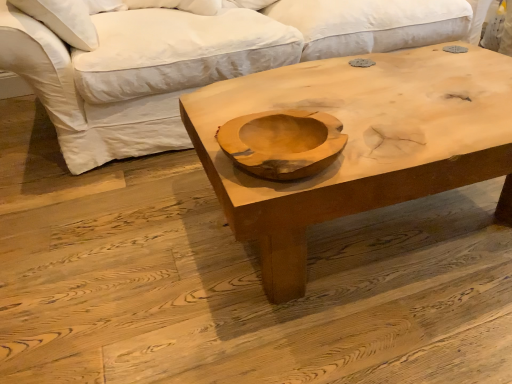
This screenshot has width=512, height=384. What are the coordinates of `white cotton studio couch at upper center` in the screenshot? It's located at (194, 61).

What do you see at coordinates (194, 61) in the screenshot?
I see `white cotton studio couch at upper center` at bounding box center [194, 61].

What is the approximate height of natural wood coffee table at center?

natural wood coffee table at center is 17.01 inches in height.

You are a GUI agent. You are given a task and a screenshot of the screen. Output one action in this format:
    pyautogui.click(x=<x>, y=<y>)
    Task: Click on the natural wood coffee table at center
    Image resolution: width=512 pixels, height=384 pixels.
    Given the screenshot: What is the action you would take?
    pyautogui.click(x=360, y=143)

Image resolution: width=512 pixels, height=384 pixels. Describe the element at coordinates (360, 143) in the screenshot. I see `natural wood coffee table at center` at that location.

Where is `white cotton studio couch at upper center`? white cotton studio couch at upper center is located at coordinates (194, 61).

Does natural wood coffee table at center appear on the right side of white cotton studio couch at upper center?

Correct, you'll find natural wood coffee table at center to the right of white cotton studio couch at upper center.

Which is in front, natural wood coffee table at center or white cotton studio couch at upper center?

natural wood coffee table at center.

Which is closer to the camera, (399,152) or (441,12)?

Point (399,152).

From the image's perspective, is natural wood coffee table at center over white cotton studio couch at upper center?

Incorrect, from the image's perspective, natural wood coffee table at center is lower than white cotton studio couch at upper center.

From a real-world perspective, is natural wood coffee table at center below white cotton studio couch at upper center?

Yes, from a real-world perspective, natural wood coffee table at center is below white cotton studio couch at upper center.

Considering the sizes of objects natural wood coffee table at center and white cotton studio couch at upper center in the image provided, who is wider, natural wood coffee table at center or white cotton studio couch at upper center?

white cotton studio couch at upper center is wider.

Considering the sizes of objects natural wood coffee table at center and white cotton studio couch at upper center in the image provided, who is taller, natural wood coffee table at center or white cotton studio couch at upper center?

white cotton studio couch at upper center is taller.

From the picture: Considering the relative sizes of natural wood coffee table at center and white cotton studio couch at upper center in the image provided, is natural wood coffee table at center smaller than white cotton studio couch at upper center?

Correct, natural wood coffee table at center occupies less space than white cotton studio couch at upper center.

Is natural wood coffee table at center positioned beyond the bounds of white cotton studio couch at upper center?

Yes, natural wood coffee table at center is outside of white cotton studio couch at upper center.

From the picture: Is natural wood coffee table at center beside white cotton studio couch at upper center?

There is a gap between natural wood coffee table at center and white cotton studio couch at upper center.

Could you tell me if natural wood coffee table at center is facing white cotton studio couch at upper center?

No, natural wood coffee table at center is not oriented towards white cotton studio couch at upper center.

Where is `studio couch above the natural wood coffee table at center (from a real-world perspective)`? The width and height of the screenshot is (512, 384). studio couch above the natural wood coffee table at center (from a real-world perspective) is located at coordinates (194, 61).

From the picture: Which object is positioned more to the right, white cotton studio couch at upper center or natural wood coffee table at center?

natural wood coffee table at center.

Is white cotton studio couch at upper center positioned before natural wood coffee table at center?

No, the depth of white cotton studio couch at upper center is greater than that of natural wood coffee table at center.

Is point (324, 33) closer or farther from the camera than point (452, 180)?

Clearly, point (324, 33) is more distant from the camera than point (452, 180).

Based on the photo, from the image's perspective, which is above, white cotton studio couch at upper center or natural wood coffee table at center?

white cotton studio couch at upper center, from the image's perspective.

From a real-world perspective, is white cotton studio couch at upper center positioned above or below natural wood coffee table at center?

Clearly, from a real-world perspective, white cotton studio couch at upper center is above natural wood coffee table at center.

Which object is wider, white cotton studio couch at upper center or natural wood coffee table at center?

white cotton studio couch at upper center.

Considering the relative sizes of white cotton studio couch at upper center and natural wood coffee table at center in the image provided, is white cotton studio couch at upper center shorter than natural wood coffee table at center?

No.

Between white cotton studio couch at upper center and natural wood coffee table at center, which one has smaller size?

With smaller size is natural wood coffee table at center.

Can we say white cotton studio couch at upper center lies outside natural wood coffee table at center?

white cotton studio couch at upper center is positioned outside natural wood coffee table at center.

Are white cotton studio couch at upper center and natural wood coffee table at center making contact?

white cotton studio couch at upper center and natural wood coffee table at center are clearly separated.

Is white cotton studio couch at upper center facing towards natural wood coffee table at center?

Yes, white cotton studio couch at upper center is turned towards natural wood coffee table at center.

From the picture: How different are the orientations of white cotton studio couch at upper center and natural wood coffee table at center in degrees?

They differ by 1.21 degrees in their facing directions.

Measure the distance between white cotton studio couch at upper center and natural wood coffee table at center.

The distance of white cotton studio couch at upper center from natural wood coffee table at center is 25.44 inches.

The width and height of the screenshot is (512, 384). What are the coordinates of `coffee table below the white cotton studio couch at upper center (from the image's perspective)` in the screenshot? It's located at (360, 143).

At what (x,y) coordinates should I click in order to perform the action: click on coffee table on the right of white cotton studio couch at upper center. Please return your answer as a coordinate pair (x, y). Image resolution: width=512 pixels, height=384 pixels. Looking at the image, I should click on (360, 143).

Identify the location of studio couch above the natural wood coffee table at center (from the image's perspective). (194, 61).